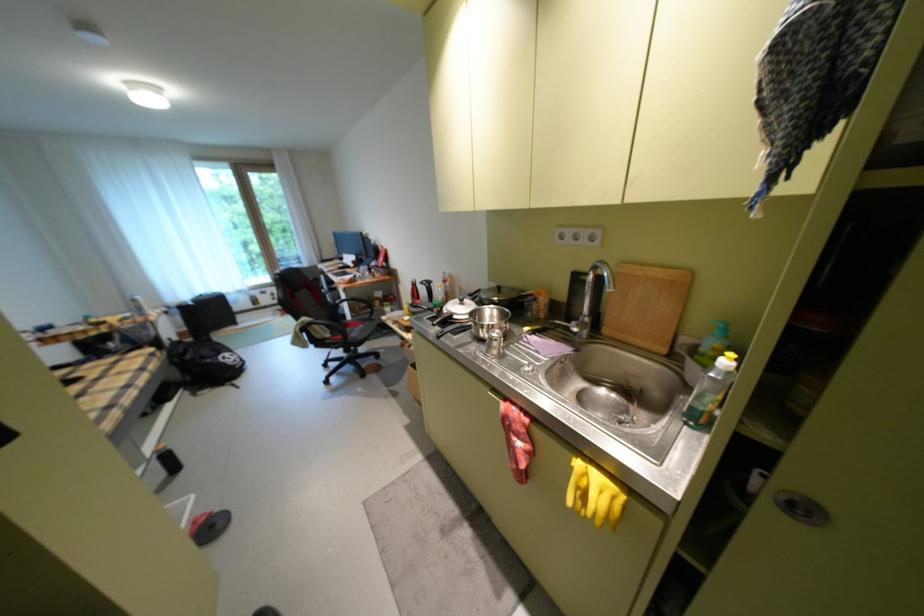
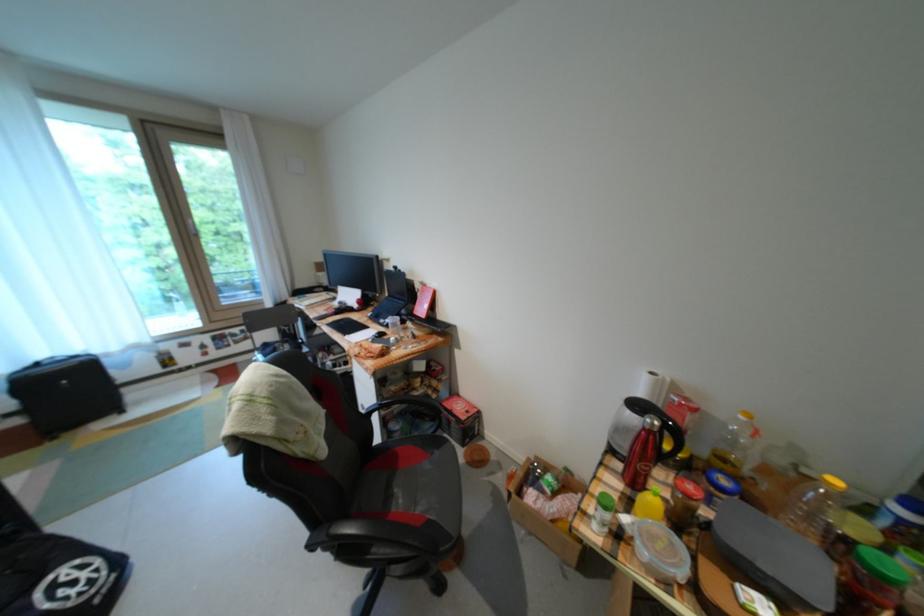
Where in the second image is the point corresponding to point 455,274 from the first image?

(662, 374)